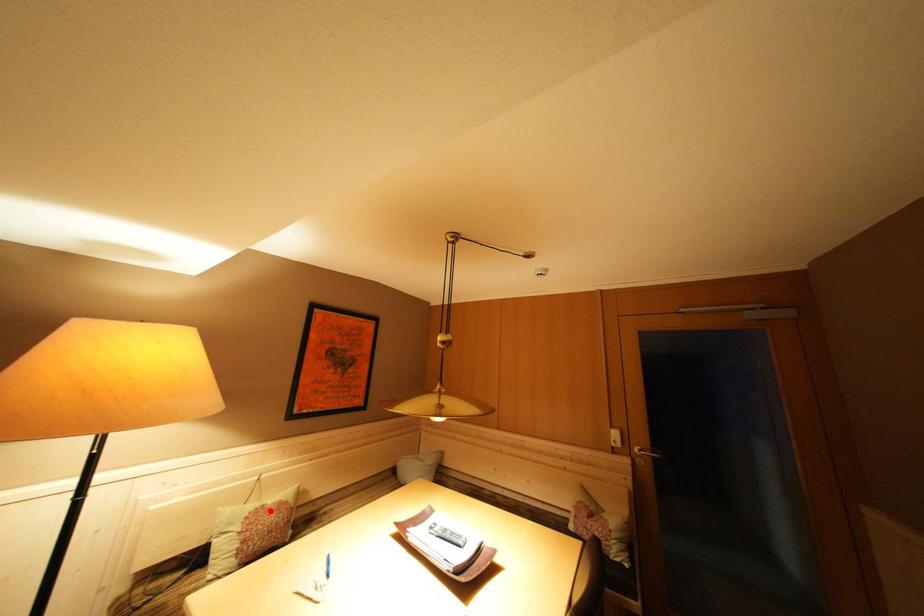
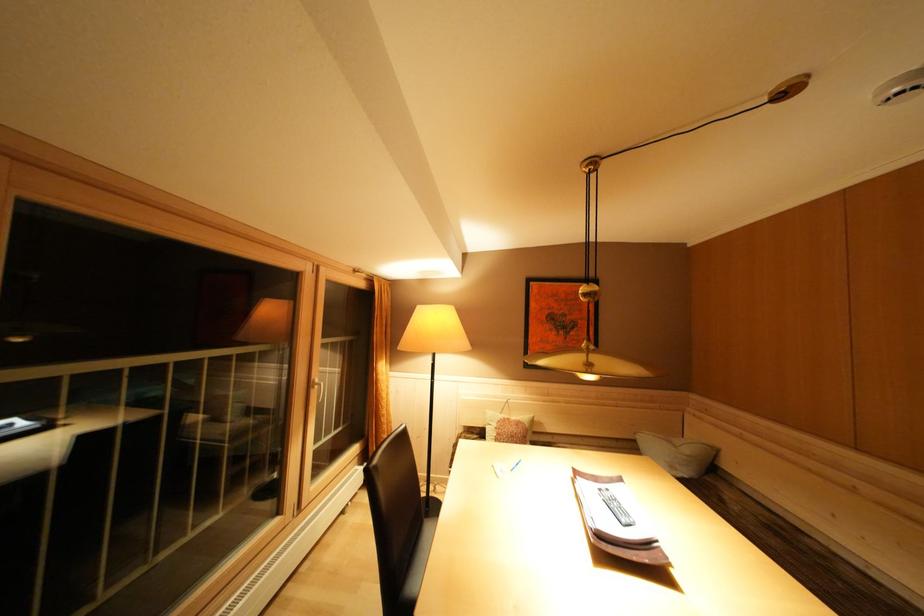
Where in the second image is the point corresponding to the highlighted location from the first image?

(515, 424)